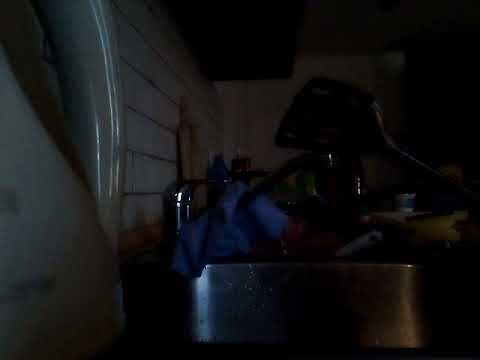
Locate an element on the screen. The width and height of the screenshot is (480, 360). kitchen sink is located at coordinates (337, 309).